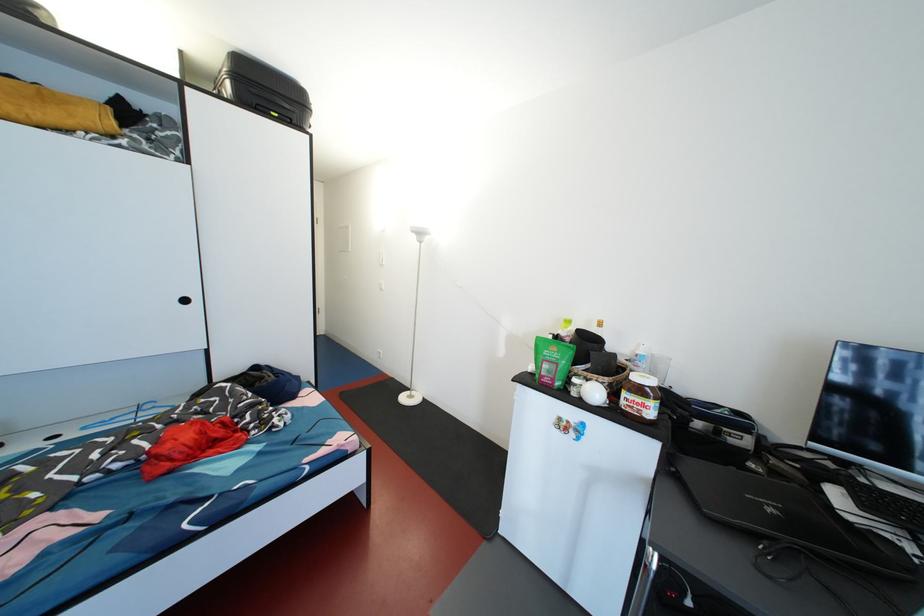
Find the location of a particular element. The width and height of the screenshot is (924, 616). green food bag is located at coordinates point(552,361).